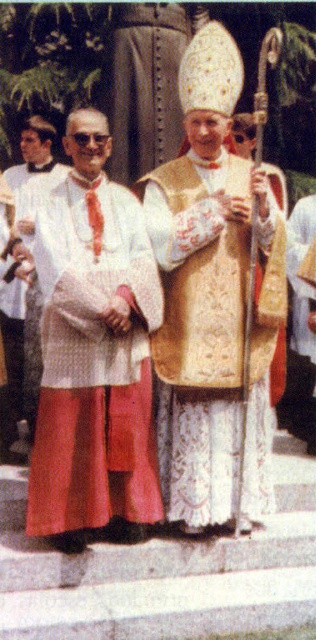
You are a photographer standing at the base of the steps where the two religious figures are standing. You want to take a closeup shot of the gold embroidered vestment at center. Given that your camera has a maximum zoom range of 5 meters, will you be able to capture the vestment clearly without moving closer?

The gold embroidered vestment at center is 4.91 meters away from the camera. Since the camera can zoom up to 5 meters, it is within range, so yes, you can capture the vestment clearly without moving closer.